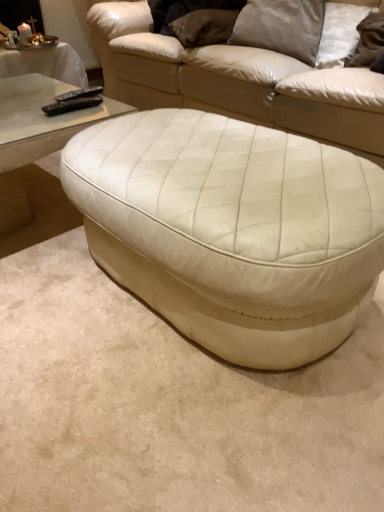
Question: Which direction should I rotate to look at suede-like beige pillow at upper center, placed as the 1th pillow when sorted from left to right, — up or down?

Choices:
 (A) down
 (B) up

Answer: (B)

Question: Does black matte remote at upper left, which is the 1th remote in back-to-front order, have a smaller size compared to black plastic remote at upper left, acting as the 2th remote starting from the back?

Choices:
 (A) no
 (B) yes

Answer: (A)

Question: Is black plastic remote at upper left, the first remote when ordered from front to back, at the back of black matte remote at upper left, which is the 1th remote in back-to-front order?

Choices:
 (A) no
 (B) yes

Answer: (A)

Question: Does black matte remote at upper left, the second remote in the front-to-back sequence, lie in front of black plastic remote at upper left, the first remote when ordered from front to back?

Choices:
 (A) yes
 (B) no

Answer: (B)

Question: Is there a large distance between black matte remote at upper left, the second remote in the front-to-back sequence, and black plastic remote at upper left, acting as the 2th remote starting from the back?

Choices:
 (A) yes
 (B) no

Answer: (B)

Question: From the image's perspective, does black matte remote at upper left, the second remote in the front-to-back sequence, appear lower than black plastic remote at upper left, the first remote when ordered from front to back?

Choices:
 (A) yes
 (B) no

Answer: (B)

Question: Is black matte remote at upper left, the second remote in the front-to-back sequence, directly adjacent to black plastic remote at upper left, the first remote when ordered from front to back?

Choices:
 (A) yes
 (B) no

Answer: (A)

Question: From the image's perspective, would you say suede-like beige pillow at upper center, placed as the 1th pillow when sorted from left to right, is positioned over satin gray pillow at upper center, placed as the second pillow when sorted from left to right?

Choices:
 (A) yes
 (B) no

Answer: (A)

Question: Is suede-like beige pillow at upper center, the third pillow viewed from the right, at the right side of satin gray pillow at upper center, which appears as the 2th pillow when viewed from the right?

Choices:
 (A) no
 (B) yes

Answer: (A)

Question: From a real-world perspective, does suede-like beige pillow at upper center, placed as the 1th pillow when sorted from left to right, stand above satin gray pillow at upper center, placed as the second pillow when sorted from left to right?

Choices:
 (A) yes
 (B) no

Answer: (B)

Question: Would you say suede-like beige pillow at upper center, the third pillow viewed from the right, is outside satin gray pillow at upper center, which appears as the 2th pillow when viewed from the right?

Choices:
 (A) no
 (B) yes

Answer: (B)

Question: Does suede-like beige pillow at upper center, the third pillow viewed from the right, have a lesser width compared to satin gray pillow at upper center, placed as the second pillow when sorted from left to right?

Choices:
 (A) yes
 (B) no

Answer: (B)

Question: Is suede-like beige pillow at upper center, placed as the 1th pillow when sorted from left to right, wider than satin gray pillow at upper center, placed as the second pillow when sorted from left to right?

Choices:
 (A) yes
 (B) no

Answer: (A)

Question: Is white leather ottoman at center positioned with its back to black plastic remote at upper left, acting as the 2th remote starting from the back?

Choices:
 (A) no
 (B) yes

Answer: (A)